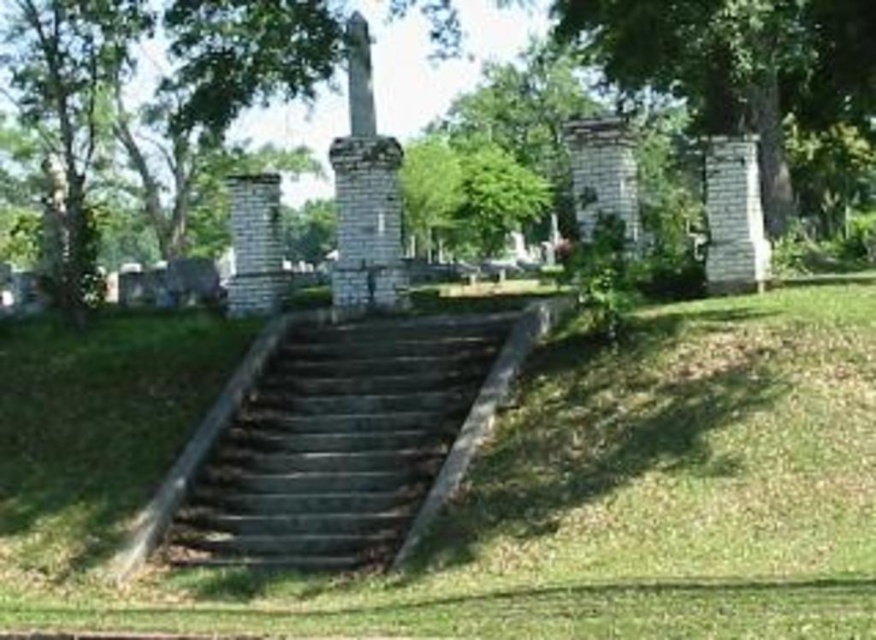
In the scene shown: You are standing at the bottom of the dark gray stone stairs at center and want to reach the green leafy tree at upper right. Which direction should you move relative to the stairs?

You should move upwards from the dark gray stone stairs at center to reach the green leafy tree at upper right since the stairs are below the tree.

Consider the image. You are standing at the bottom of the dark gray stone stairs at center and want to reach the platform above. There is a green leafy tree at upper right nearby. Which object takes up more space in the image?

The green leafy tree at upper right takes up more space in the image than the dark gray stone stairs at center because the dark gray stone stairs at center occupies less space than green leafy tree at upper right.

You are standing at the bottom of the dark gray stone stairs at center and want to walk up to the platform. As you climb the stairs, will you pass in front of or behind the green leafy tree at upper right?

The dark gray stone stairs at center is in front of the green leafy tree at upper right, so as you climb the stairs, you will be moving in front of the tree, meaning the tree is behind you. Therefore, you will pass behind the green leafy tree at upper right.